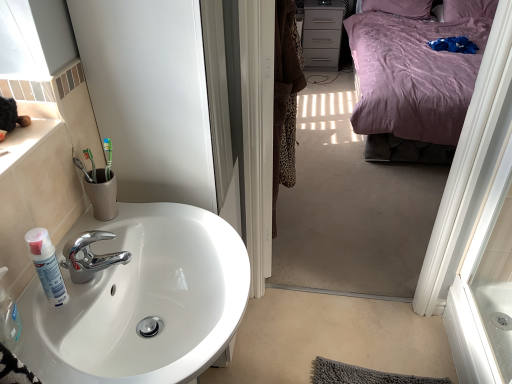
Question: Is white glossy sink at lower left facing towards white matte spray can at sink left?

Choices:
 (A) no
 (B) yes

Answer: (A)

Question: Does white glossy sink at lower left have a lesser width compared to white matte spray can at sink left?

Choices:
 (A) yes
 (B) no

Answer: (B)

Question: From the image's perspective, is white glossy sink at lower left on top of white matte spray can at sink left?

Choices:
 (A) no
 (B) yes

Answer: (A)

Question: From the image's perspective, would you say white glossy sink at lower left is shown under white matte spray can at sink left?

Choices:
 (A) no
 (B) yes

Answer: (B)

Question: Can white matte spray can at sink left be found inside white glossy sink at lower left?

Choices:
 (A) no
 (B) yes

Answer: (A)

Question: Considering the relative sizes of white glossy sink at lower left and white matte spray can at sink left in the image provided, is white glossy sink at lower left smaller than white matte spray can at sink left?

Choices:
 (A) yes
 (B) no

Answer: (B)

Question: Are green toothbrush at sink and purple satin bed at upper right located far from each other?

Choices:
 (A) no
 (B) yes

Answer: (B)

Question: Can we say green toothbrush at sink lies outside purple satin bed at upper right?

Choices:
 (A) yes
 (B) no

Answer: (A)

Question: From the image's perspective, does green toothbrush at sink appear lower than purple satin bed at upper right?

Choices:
 (A) no
 (B) yes

Answer: (B)

Question: Does green toothbrush at sink have a lesser width compared to purple satin bed at upper right?

Choices:
 (A) yes
 (B) no

Answer: (A)

Question: Considering the relative positions of green toothbrush at sink and purple satin bed at upper right in the image provided, is green toothbrush at sink to the left of purple satin bed at upper right from the viewer's perspective?

Choices:
 (A) yes
 (B) no

Answer: (A)

Question: Does green toothbrush at sink contain purple satin bed at upper right?

Choices:
 (A) yes
 (B) no

Answer: (B)

Question: Is green toothbrush at sink placed right next to white glossy sink at lower left?

Choices:
 (A) yes
 (B) no

Answer: (B)